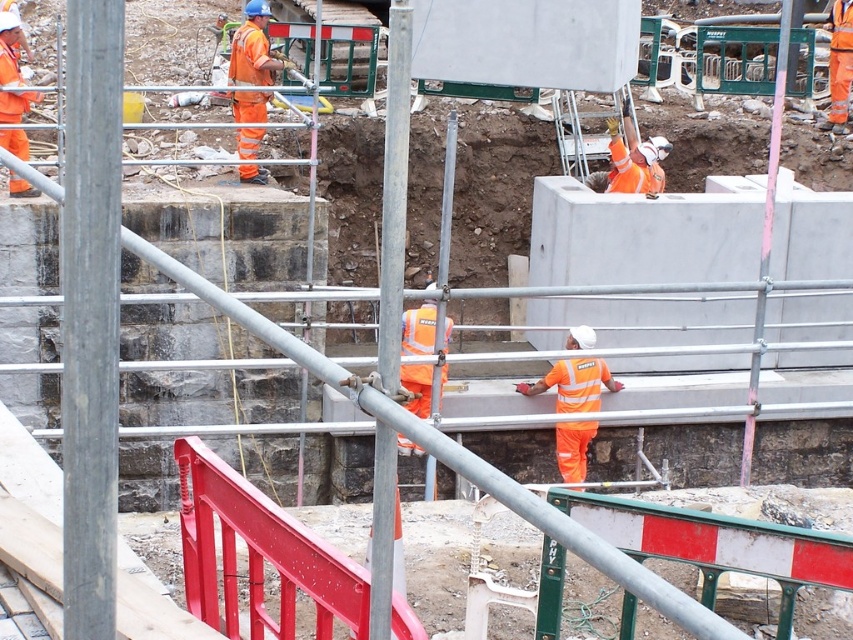
In the scene shown: You are a safety inspector at the construction site. You notice two orange items in the scene. One is the orange reflective vest at center, and the other is the orange reflective workwear at upper center. Which of these items is positioned lower in the image?

The orange reflective vest at center is located below the orange reflective workwear at upper center, so it is positioned lower in the image.

You are a safety inspector standing at the camera position. You notice the orange reflective vest at center worn by a worker. Can you clearly see the details of the vest from your current position? Please explain your reasoning.

The orange reflective vest at center and the camera are 14.53 meters apart. While the distance is significant, the vest is orange and reflective, which are designed to be highly visible even from afar. Therefore, you should be able to see the vest clearly, though finer details might be harder to discern at that distance.

Based on the coordinates provided, what object is located at point (573, 384) in the construction site image?

The point (573, 384) corresponds to the orange reflective vest at center.